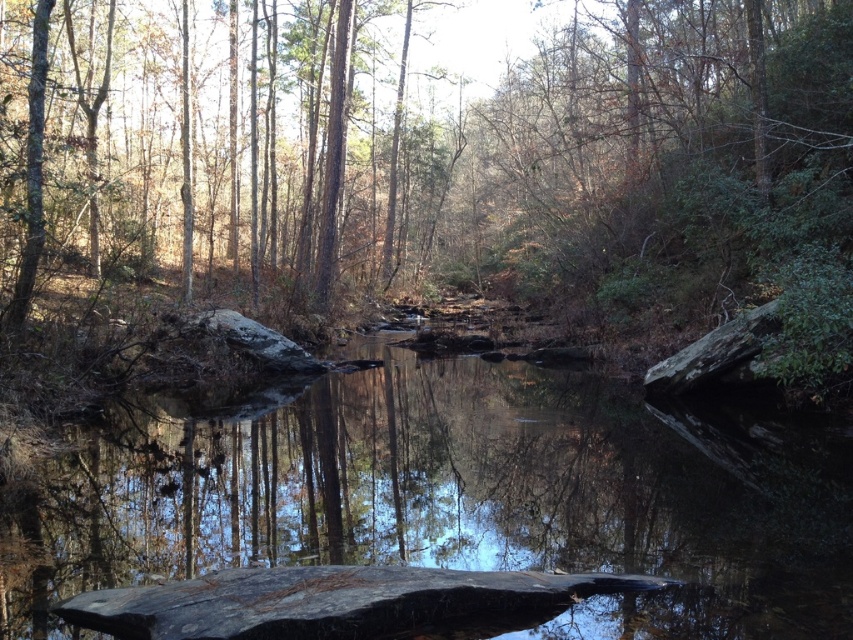
You are standing at the edge of the forest stream and see a point marked at coordinates (x=442, y=168). Based on the scene description, what object does this point most likely represent?

The point at (x=442, y=168) corresponds to a green leafy tree at center.

You are standing at point (x=442, y=168) in the forest. What can you see directly in front of you?

You can see a green leafy tree at center directly in front of you.

What are the coordinates of the green leafy tree at center?

The green leafy tree at center is located at coordinates point (442, 168).